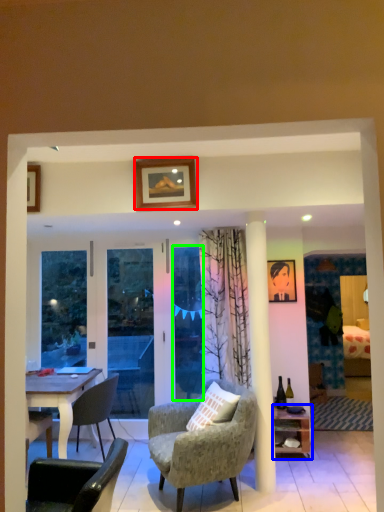
Question: Based on their relative distances, which object is nearer to picture frame (highlighted by a red box)? Choose from shelf (highlighted by a blue box) and glass door (highlighted by a green box).

Choices:
 (A) shelf
 (B) glass door

Answer: (B)